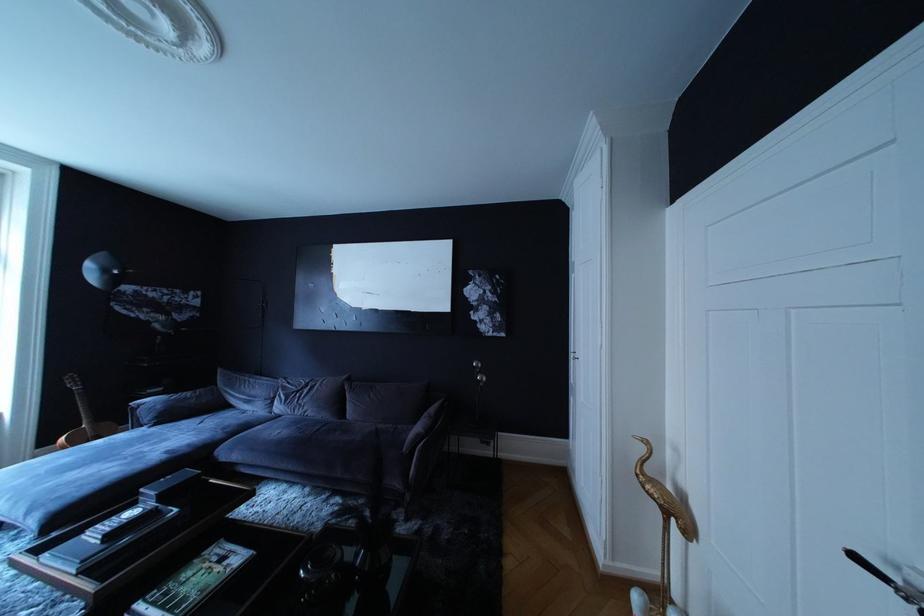
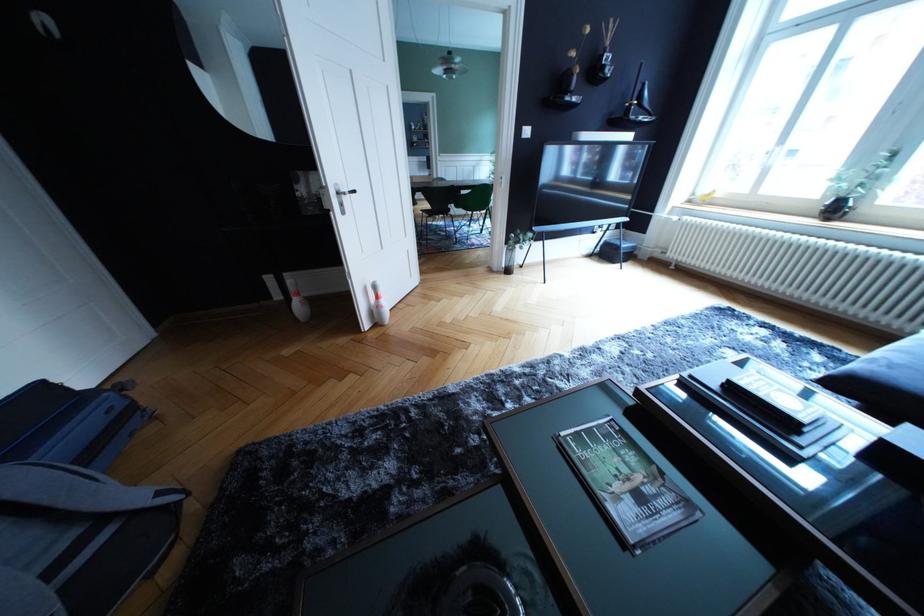
The point at (x=232, y=565) is marked in the first image. Where is the corresponding point in the second image?

(649, 504)